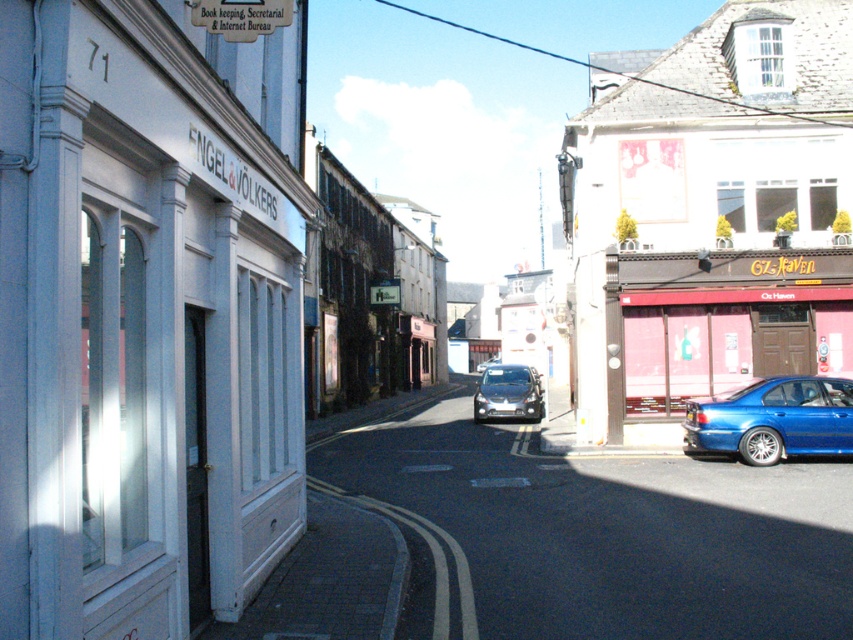
Question: Among these objects, which one is farthest from the camera?

Choices:
 (A) metallic blue car at right
 (B) shiny silver car at center
 (C) pink matte door at right

Answer: (B)

Question: Is metallic blue car at right positioned in front of pink matte door at right?

Choices:
 (A) no
 (B) yes

Answer: (B)

Question: Is metallic blue car at right thinner than shiny silver car at center?

Choices:
 (A) yes
 (B) no

Answer: (B)

Question: Which object is the closest to the shiny silver car at center?

Choices:
 (A) pink matte door at right
 (B) metallic blue car at right
 (C) glossy blue sedan at lower right

Answer: (B)

Question: Estimate the real-world distances between objects in this image. Which object is farther from the metallic blue car at right?

Choices:
 (A) shiny silver car at center
 (B) glossy blue sedan at lower right

Answer: (A)

Question: Does metallic blue car at right appear under shiny silver car at center?

Choices:
 (A) yes
 (B) no

Answer: (B)